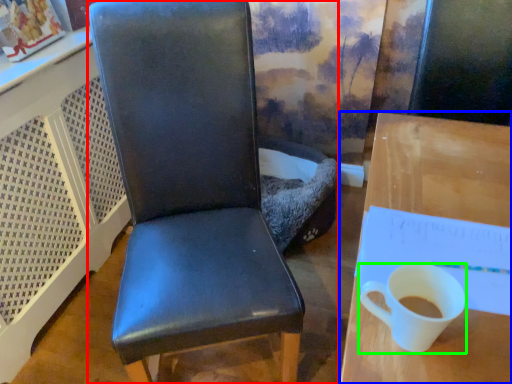
Question: Considering the real-world distances, which object is farthest from chair (highlighted by a red box)? desk (highlighted by a blue box) or coffee cup (highlighted by a green box)?

Choices:
 (A) desk
 (B) coffee cup

Answer: (B)